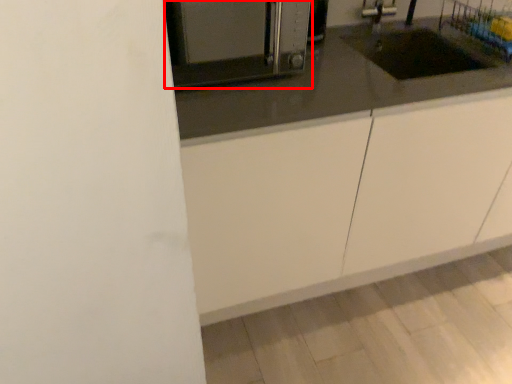
Question: From the image's perspective, where is home appliance (annotated by the red box) located relative to cabinetry?

Choices:
 (A) below
 (B) above

Answer: (B)